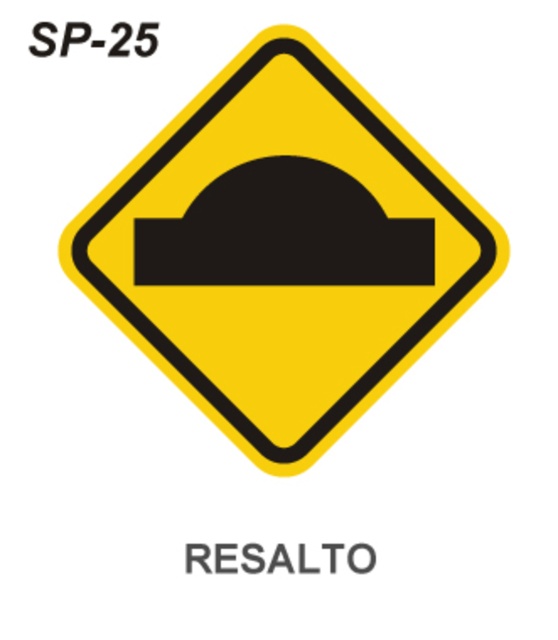
You are a driver approaching an intersection and see two signs at the center of the road. One is the yellow matte road sign at center, and the other is the black rubber sign at center. According to the scene description, which sign is positioned to the left of the other?

The yellow matte road sign at center is positioned to the left of the black rubber sign at center.

You are a driver approaching an intersection and see the yellow matte road sign at center ahead. Based on its position, can you determine if it is placed on the left or right side of the road?

The yellow matte road sign at center is positioned at point (282, 250), which indicates it is placed on the left side of the road.

You are driving a car and see the yellow matte road sign at center and the black rubber sign at center. Which one is nearer to your car?

The yellow matte road sign at center is closer to the viewer than black rubber sign at center, so the yellow matte road sign at center is nearer to your car.